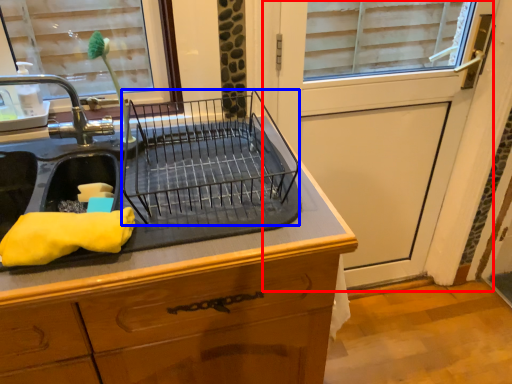
Question: Which object is further to the camera taking this photo, screen door (highlighted by a red box) or appliance (highlighted by a blue box)?

Choices:
 (A) screen door
 (B) appliance

Answer: (A)